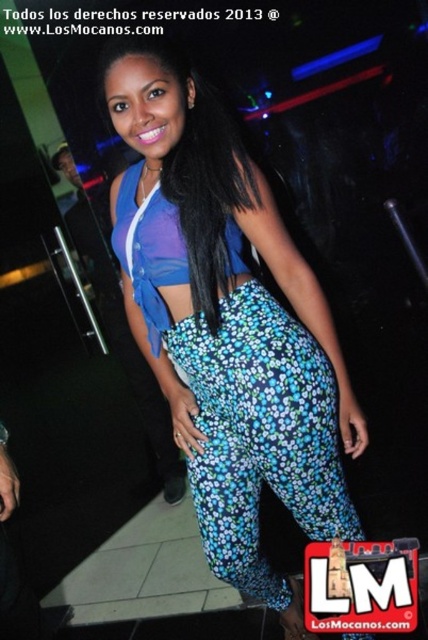
You are a photographer trying to capture the woman in the nightclub scene. You notice the floral printed pants at center and the black silky hair at center. Which object would appear wider in the photo?

The floral printed pants at center might be wider than black silky hair at center, so it would appear wider in the photo.